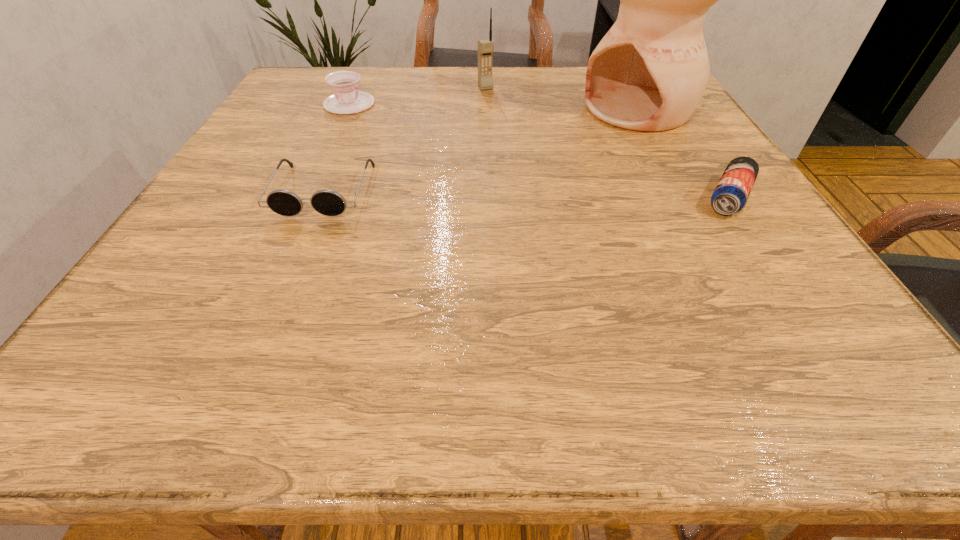
This screenshot has height=540, width=960. Identify the location of unoccupied position between the pottery and the beer can. (684, 153).

Where is `free area in between the sunglasses and the teacup`? free area in between the sunglasses and the teacup is located at coordinates (336, 147).

This screenshot has width=960, height=540. In order to click on object identified as the third closest to the teacup in this screenshot , I will do `click(649, 72)`.

The width and height of the screenshot is (960, 540). What are the coordinates of `object that is the closest to the teacup` in the screenshot? It's located at (327, 202).

Where is `free space that satisfies the following two spatial constraints: 1. on the front side of the pottery; 2. on the right side of the teacup`? free space that satisfies the following two spatial constraints: 1. on the front side of the pottery; 2. on the right side of the teacup is located at coordinates (347, 109).

You are a GUI agent. You are given a task and a screenshot of the screen. Output one action in this format:
    pyautogui.click(x=<x>, y=<y>)
    Task: Click on the free space that satisfies the following two spatial constraints: 1. on the front side of the beer can; 2. on the left side of the teacup
    
    Given the screenshot: What is the action you would take?
    pyautogui.click(x=306, y=198)

This screenshot has width=960, height=540. Find the location of `blank space that satisfies the following two spatial constraints: 1. on the front-facing side of the beer can; 2. on the left side of the sunglasses`. blank space that satisfies the following two spatial constraints: 1. on the front-facing side of the beer can; 2. on the left side of the sunglasses is located at coordinates (321, 198).